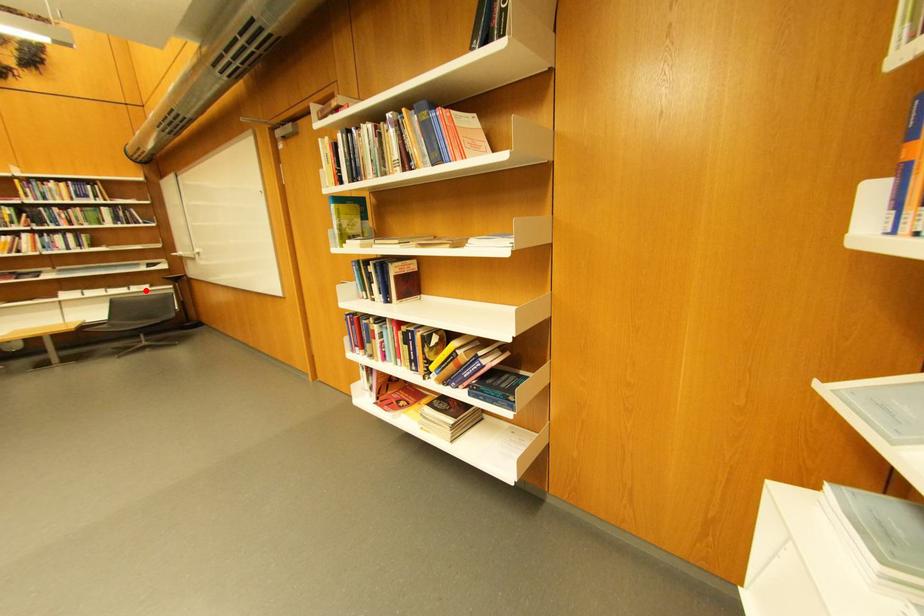
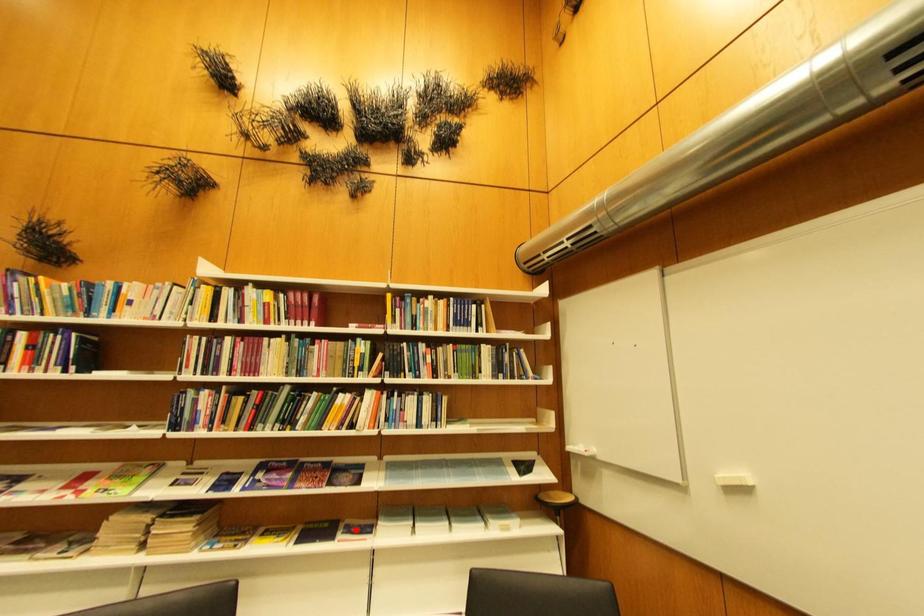
I am providing you with two images of the same scene from different viewpoints. A red point is marked on the first image and another point is marked on the second image. Do the highlighted points in image1 and image2 indicate the same real-world spot?

No